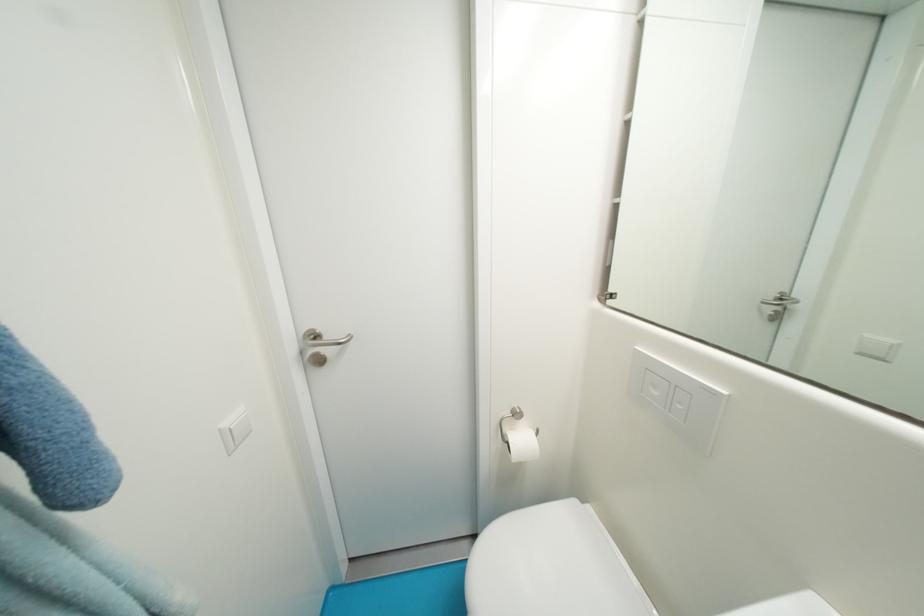
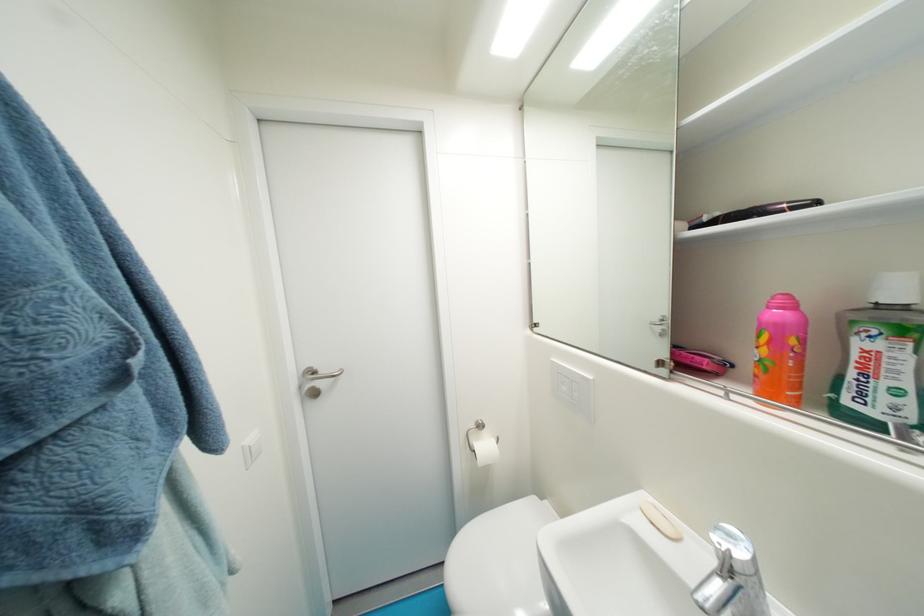
Where in the second image is the point corresponding to (529,442) from the first image?

(492, 448)